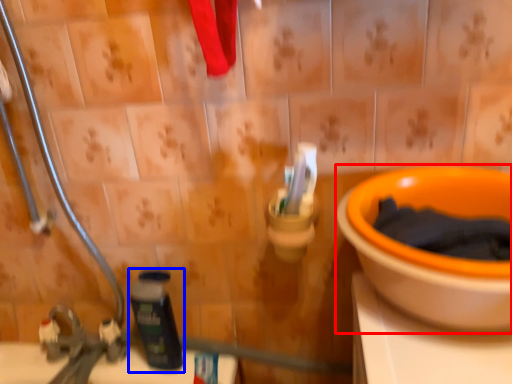
Question: Among these objects, which one is farthest to the camera, toilet (highlighted by a red box) or bottle (highlighted by a blue box)?

Choices:
 (A) toilet
 (B) bottle

Answer: (B)